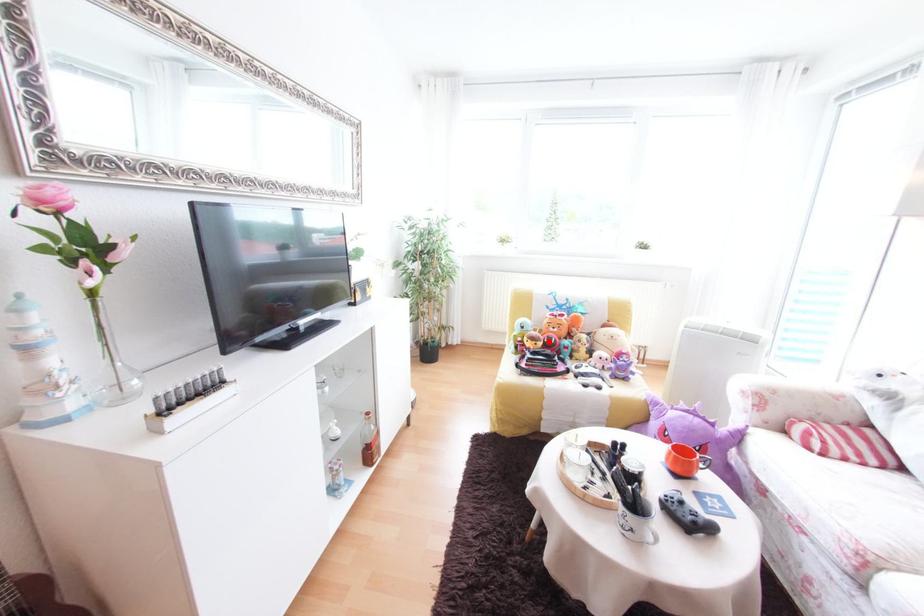
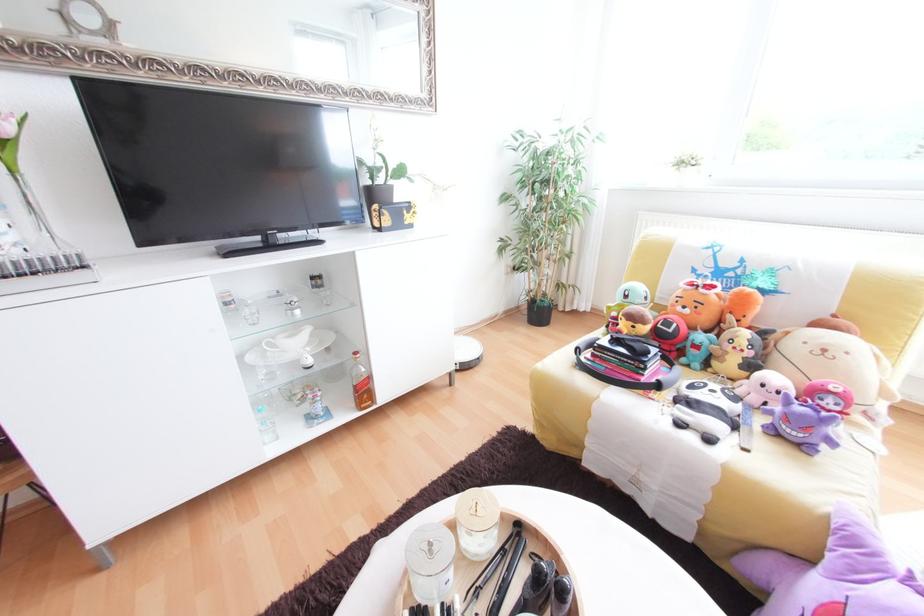
In the second image, find the point that corresponds to the highlighted location in the first image.

(652, 323)